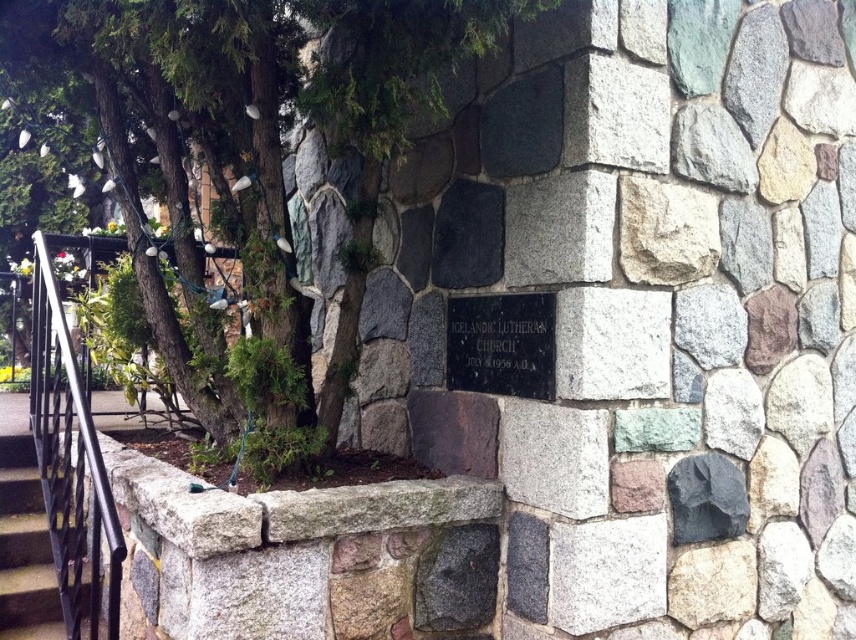
Is point (281, 29) farther from viewer compared to point (455, 333)?

No, (281, 29) is in front of (455, 333).

Can you confirm if green leafy tree at center is positioned to the right of black polished stone plaque at center?

Incorrect, green leafy tree at center is not on the right side of black polished stone plaque at center.

Who is more distant from viewer, [177,42] or [483,378]?

The point [483,378] is more distant.

Locate an element on the screen. This screenshot has width=856, height=640. green leafy tree at center is located at coordinates click(253, 154).

Is point (536, 296) in front of point (21, 548)?

Yes, it is.

Is black polished stone plaque at center wider than black metal stairs at lower left?

Incorrect, black polished stone plaque at center's width does not surpass black metal stairs at lower left's.

Is point (528, 358) positioned behind point (49, 588)?

No, (528, 358) is in front of (49, 588).

Locate an element on the screen. This screenshot has width=856, height=640. black polished stone plaque at center is located at coordinates (501, 344).

Which is more to the right, green leafy tree at center or black wrought iron railing at left?

green leafy tree at center is more to the right.

Based on the photo, which is below, green leafy tree at center or black wrought iron railing at left?

black wrought iron railing at left is lower down.

The width and height of the screenshot is (856, 640). I want to click on green leafy tree at center, so click(x=253, y=154).